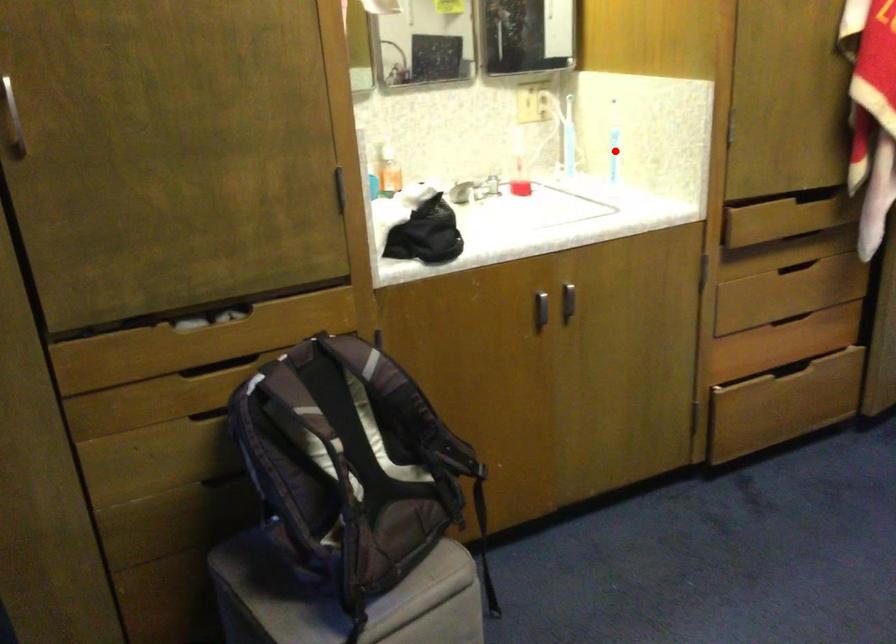
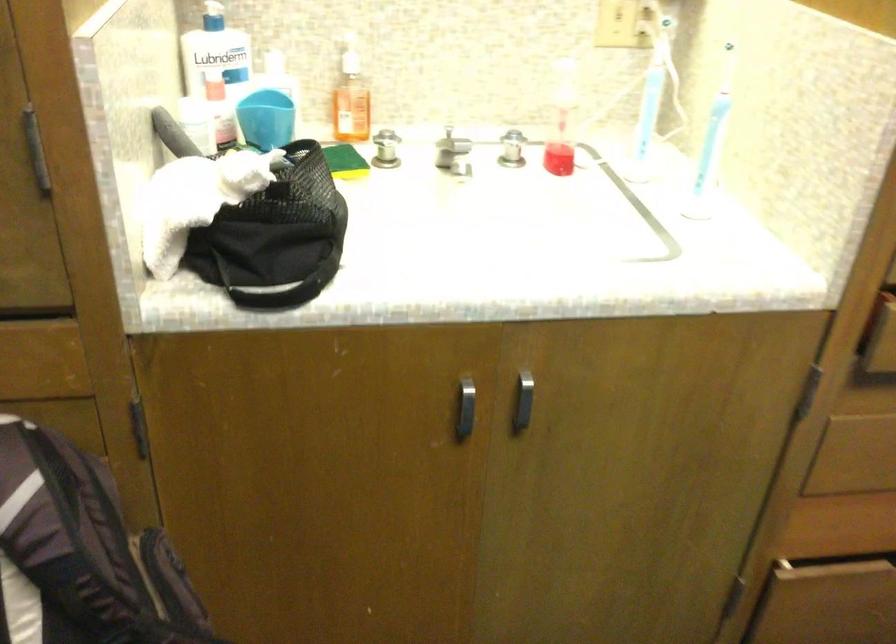
Question: I am providing you with two images of the same scene from different viewpoints. A red point is marked on the first image. At the location where the point appears in image 1, is it still visible in image 2?

Choices:
 (A) Yes
 (B) No

Answer: (A)